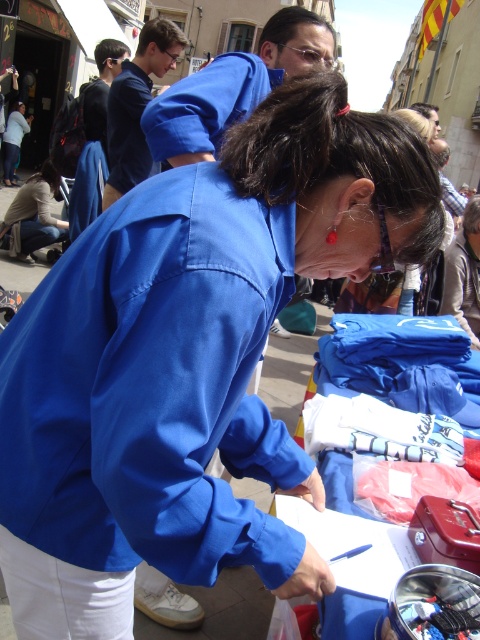
Is blue fabric shirt at upper center to the right of light brown leather jacket at lower left from the viewer's perspective?

Yes, blue fabric shirt at upper center is to the right of light brown leather jacket at lower left.

Who is positioned more to the left, blue fabric shirt at upper center or light brown leather jacket at lower left?

Positioned to the left is light brown leather jacket at lower left.

Is point (157, 128) more distant than point (48, 168)?

No, it is in front of (48, 168).

This screenshot has height=640, width=480. I want to click on blue fabric shirt at upper center, so click(233, 88).